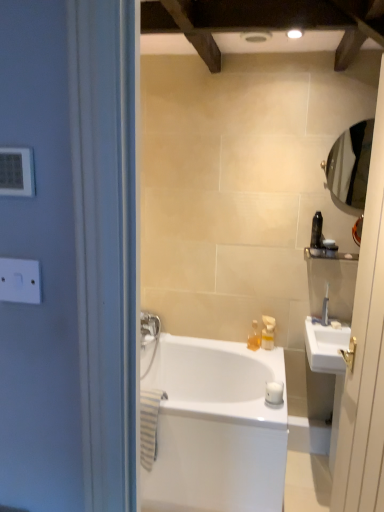
Where is `free space in front of translucent plastic bottles at upper center, the 3th toiletry positioned from the top`? The width and height of the screenshot is (384, 512). free space in front of translucent plastic bottles at upper center, the 3th toiletry positioned from the top is located at coordinates tap(264, 359).